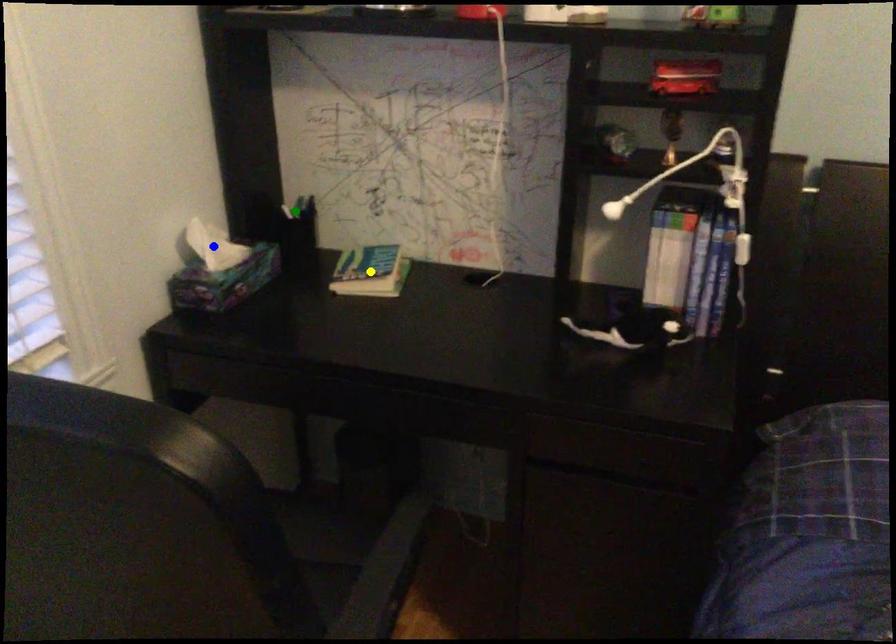
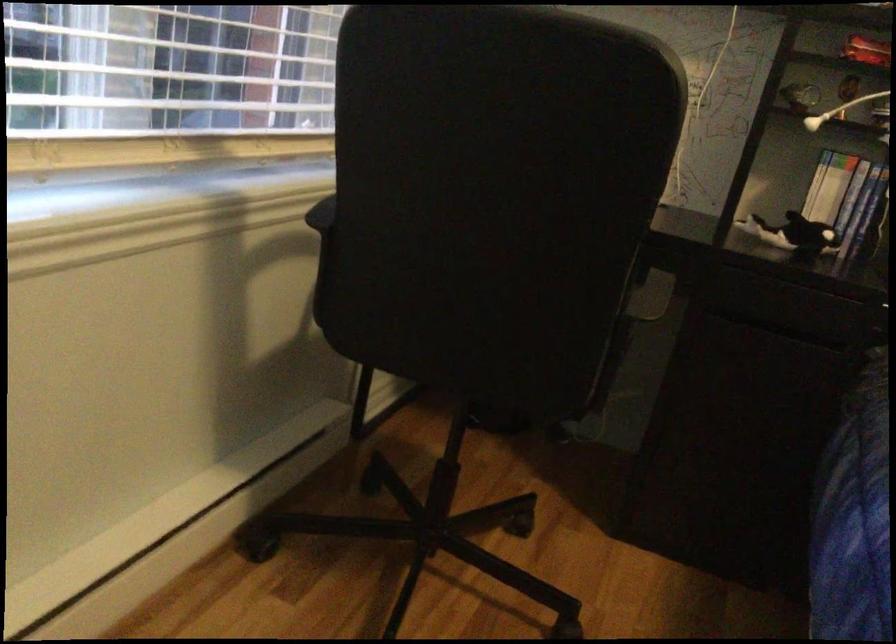
I am providing you with two images of the same scene from different viewpoints. Three points are marked in image1. Which point corresponds to a part or object that is occluded in image2?In image1, three points are marked. Which of them correspond to a part or object that is occluded in image2?Among the three points shown in image1, which one corresponds to a part or object that is no longer visible due to occlusion in image2?

Invisible in image2: blue point, green point, yellow point.